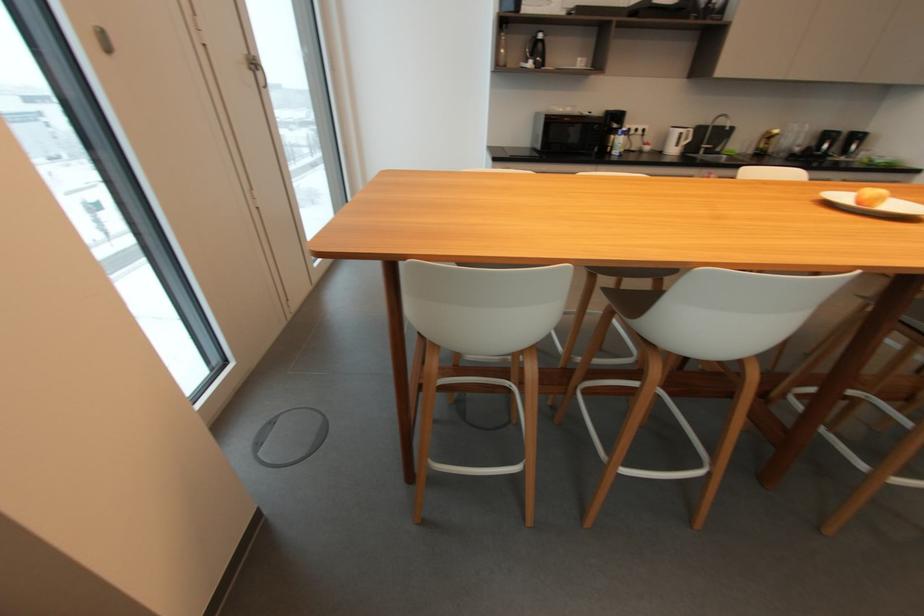
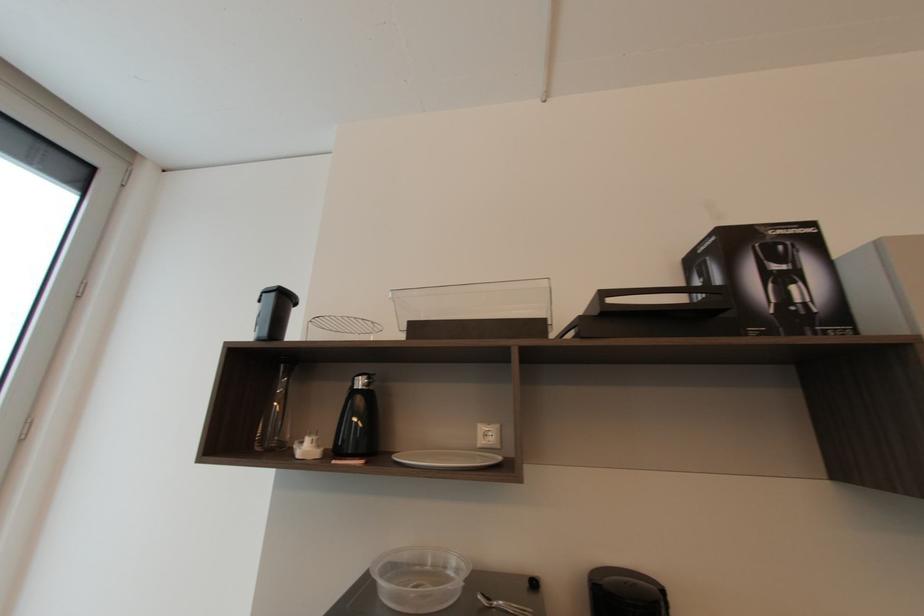
Where in the second image is the point corresponding to point 544,36 from the first image?

(362, 384)